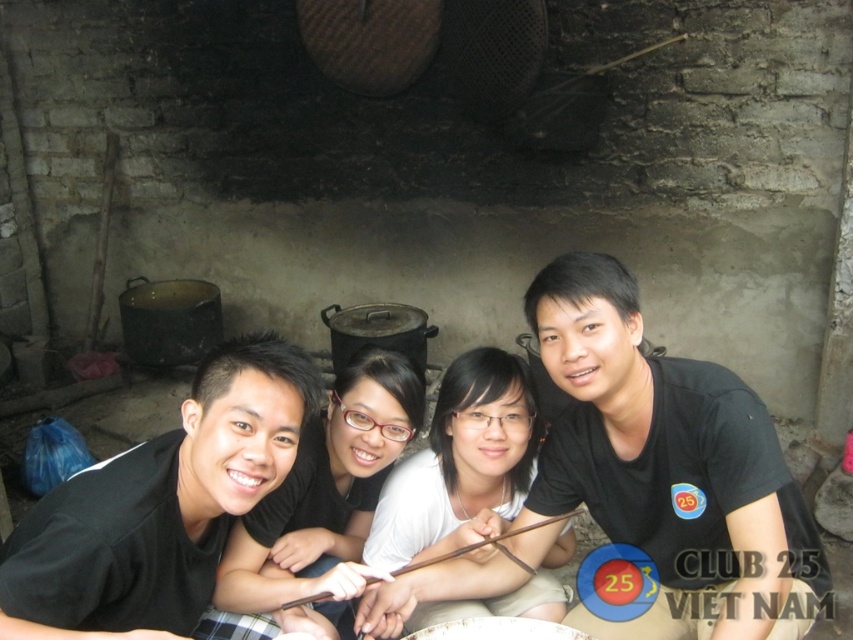
Does black matte shirt at center come behind black matte shirt at left?

Yes, black matte shirt at center is behind black matte shirt at left.

Is black matte shirt at center positioned before black matte shirt at left?

No, black matte shirt at center is behind black matte shirt at left.

Is point (634, 289) positioned behind point (256, 408)?

That is True.

Find the location of a particular element. The width and height of the screenshot is (853, 640). black matte shirt at center is located at coordinates (668, 467).